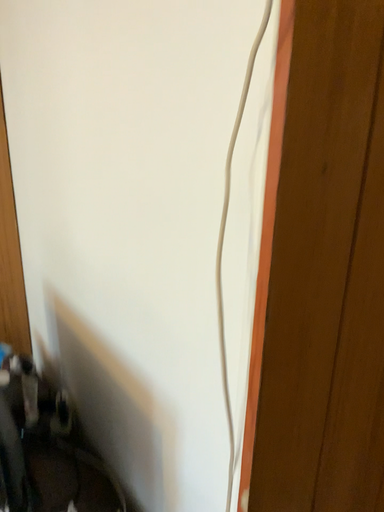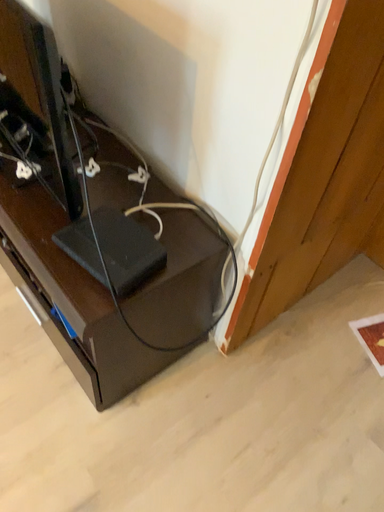
Question: Which way did the camera rotate in the video?

Choices:
 (A) rotated upward
 (B) rotated downward

Answer: (B)